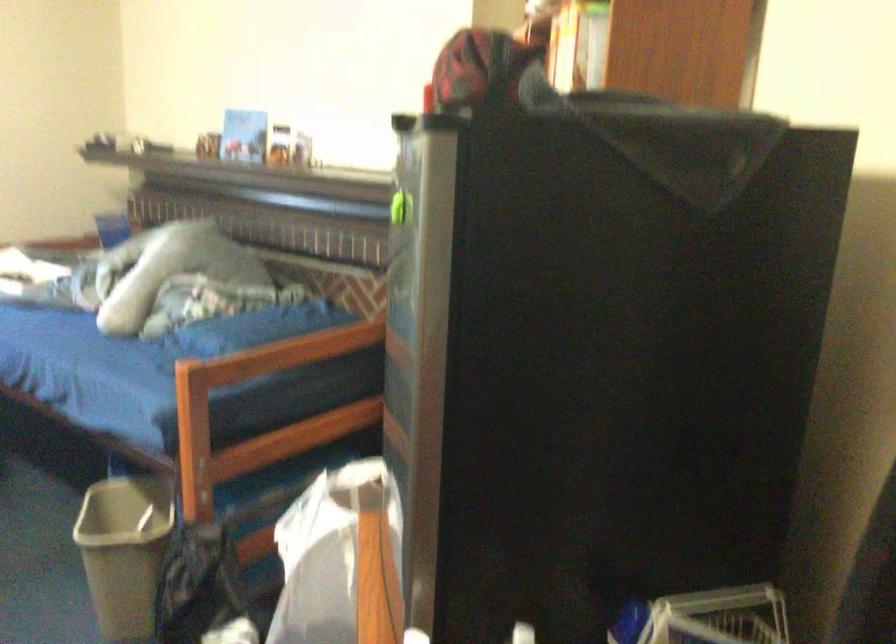
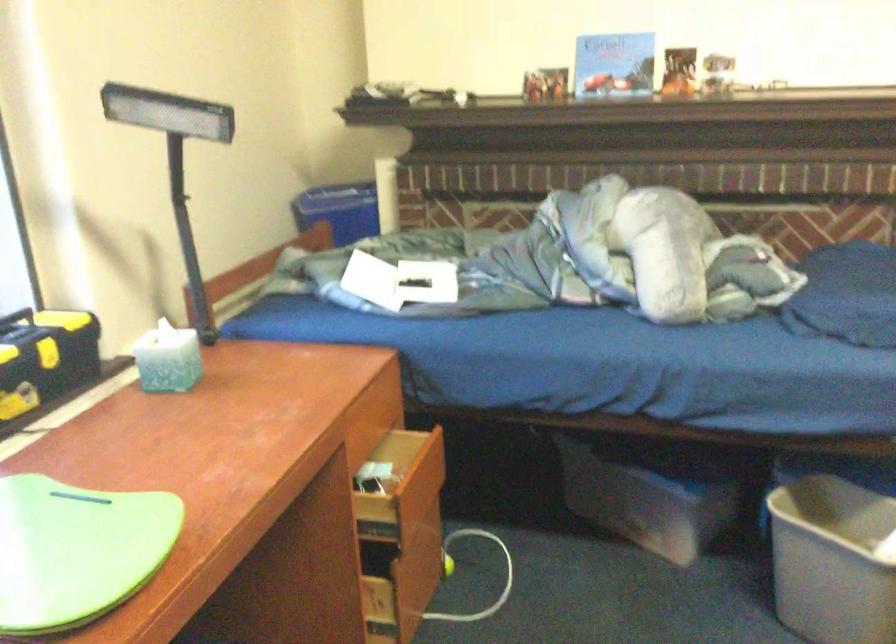
Find the pixel in the second image that matches point (107, 538) in the first image.

(832, 561)